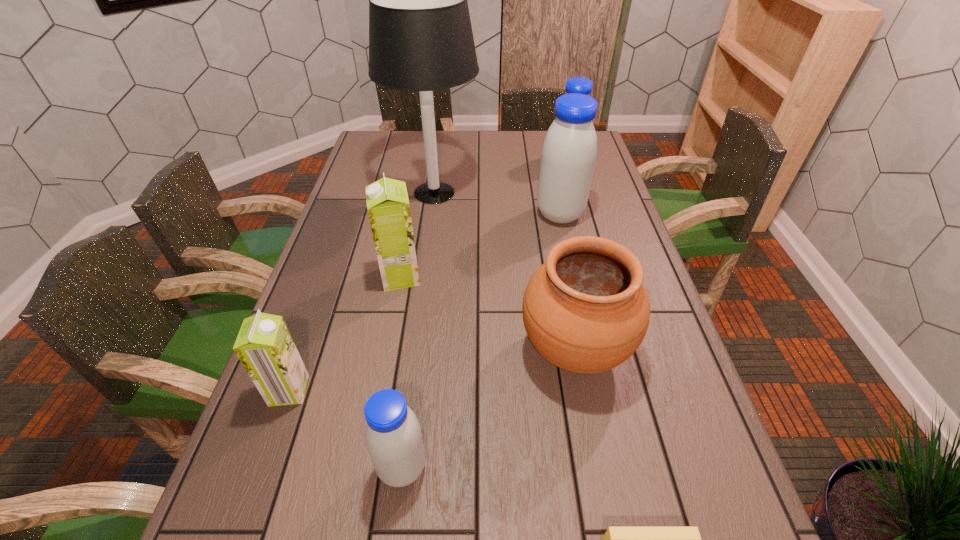
You are a GUI agent. You are given a task and a screenshot of the screen. Output one action in this format:
    pyautogui.click(x=<x>, y=<y>)
    Task: Click on the nearest blue soya milk
    
    Given the screenshot: What is the action you would take?
    pyautogui.click(x=393, y=437)

Identify the location of the smallest blue soya milk. (393, 437).

Where is `vacant area situated on the front of the table lamp`? vacant area situated on the front of the table lamp is located at coordinates (423, 272).

The height and width of the screenshot is (540, 960). Find the location of `blank space located on the left of the tallest soya milk`. blank space located on the left of the tallest soya milk is located at coordinates (433, 214).

Locate an element on the screen. The width and height of the screenshot is (960, 540). vacant region located on the back of the bigger green soya milk is located at coordinates (416, 198).

Find the location of `vacant space positioned on the front of the farthest blue soya milk`. vacant space positioned on the front of the farthest blue soya milk is located at coordinates (587, 229).

The width and height of the screenshot is (960, 540). Identify the location of vacant region located 0.400m on the left of the pottery. (348, 350).

At what (x,y) coordinates should I click in order to perform the action: click on free region located on the back of the smaller green soya milk. Please return your answer as a coordinate pair (x, y). The width and height of the screenshot is (960, 540). Looking at the image, I should click on (325, 287).

Find the location of a particular element. This screenshot has height=540, width=960. free location located on the right of the smallest blue soya milk is located at coordinates (500, 468).

Where is `object that is at the far edge`? object that is at the far edge is located at coordinates (581, 85).